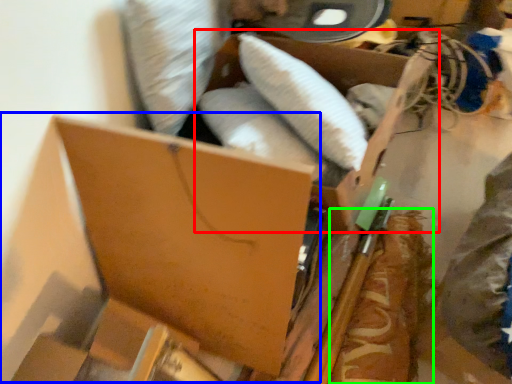
Question: Estimate the real-world distances between objects in this image. Which object is farther from storage box (highlighted by a red box), storage box (highlighted by a blue box) or food (highlighted by a green box)?

Choices:
 (A) storage box
 (B) food

Answer: (A)